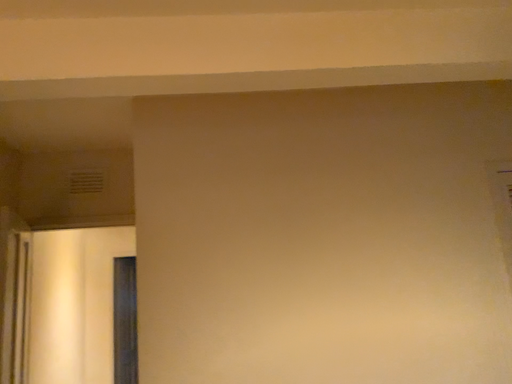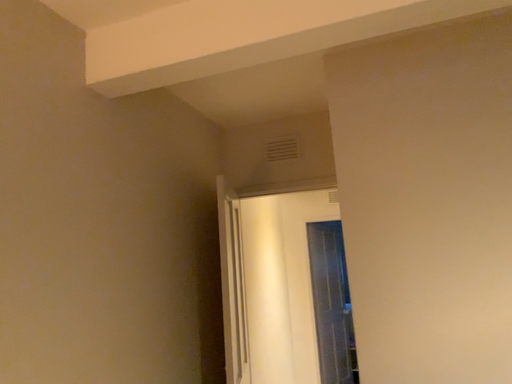
Question: Which way did the camera rotate in the video?

Choices:
 (A) rotated right
 (B) rotated left

Answer: (B)